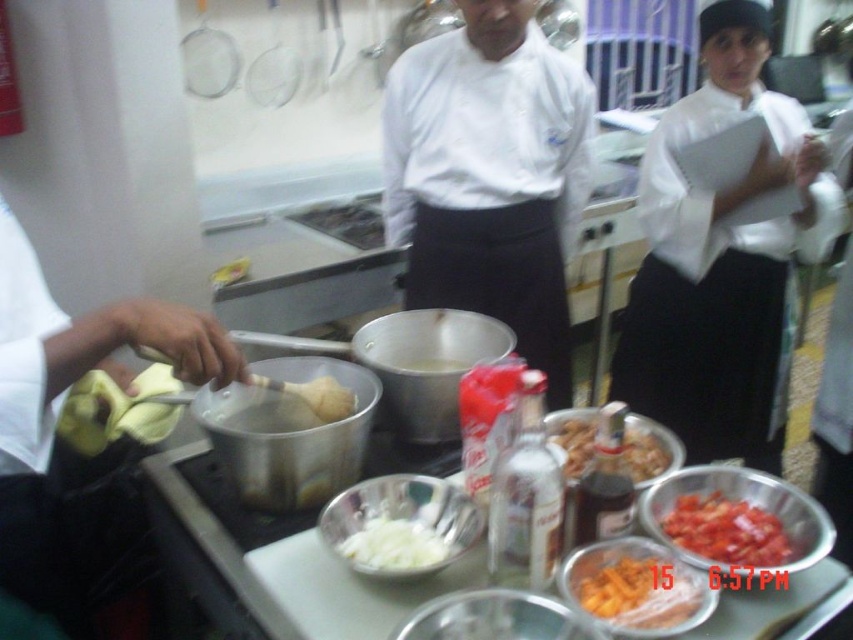
What is the position of the white glossy chef coat at center relative to the point marked at coordinates [490,176]?

The point marked at coordinates [490,176] is exactly where the white glossy chef coat at center is located.